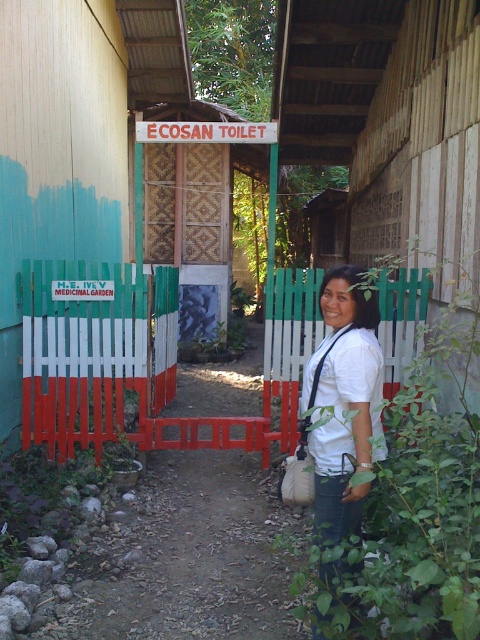
Is white matte shirt at center above green wooden fence at center?

Incorrect, white matte shirt at center is not positioned above green wooden fence at center.

Does white matte shirt at center have a lesser width compared to green wooden fence at center?

Correct, white matte shirt at center's width is less than green wooden fence at center's.

Locate an element on the screen. white matte shirt at center is located at coordinates (344, 401).

Identify the location of white matte shirt at center. This screenshot has height=640, width=480. (344, 401).

Can you confirm if green painted wood fence at center is positioned to the left of white matte shirt at center?

Yes, green painted wood fence at center is to the left of white matte shirt at center.

Does green painted wood fence at center come behind white matte shirt at center?

Yes, green painted wood fence at center is behind white matte shirt at center.

The height and width of the screenshot is (640, 480). Identify the location of green painted wood fence at center. (145, 362).

Image resolution: width=480 pixels, height=640 pixels. I want to click on green painted wood fence at center, so click(x=145, y=362).

Where is `green painted wood fence at center`? green painted wood fence at center is located at coordinates (145, 362).